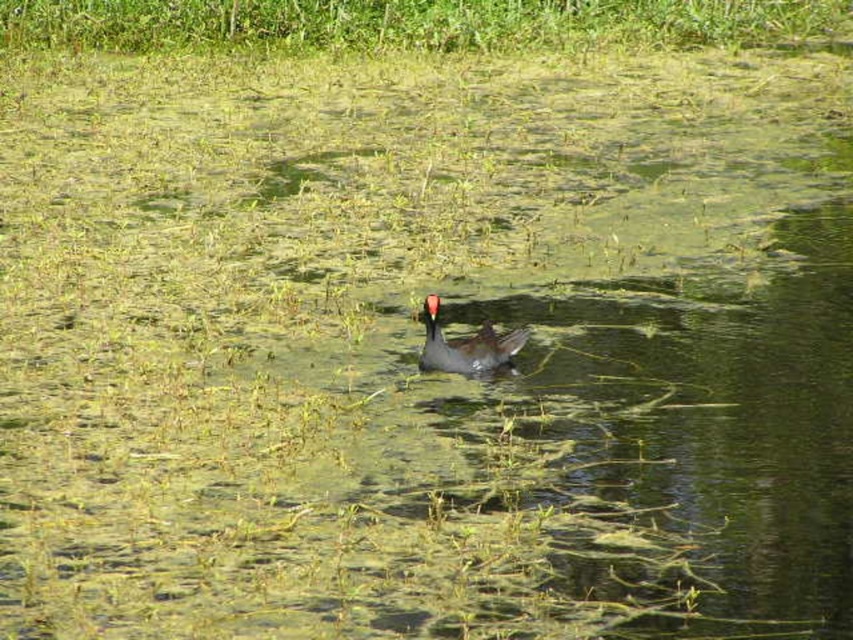
Is point (532, 3) behind point (509, 358)?

Yes, it is behind point (509, 358).

Does green leafy grass at upper center lie behind dark gray duck at center?

Yes.

Image resolution: width=853 pixels, height=640 pixels. I want to click on green leafy grass at upper center, so click(x=407, y=22).